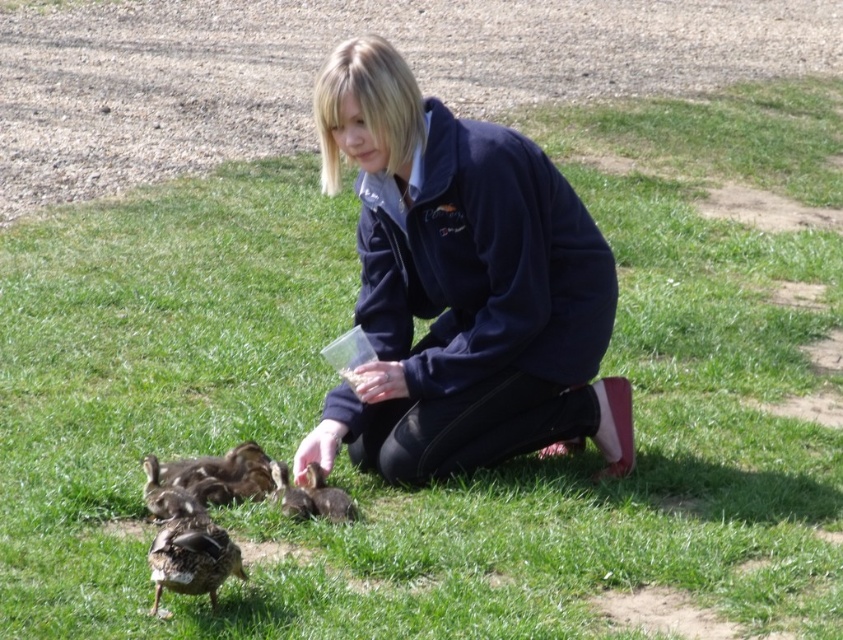
Is navy blue fleece at center thinner than brown fuzzy duckling at lower left?

No.

Does navy blue fleece at center have a greater height compared to brown fuzzy duckling at lower left?

Indeed, navy blue fleece at center has a greater height compared to brown fuzzy duckling at lower left.

Which is behind, point (435, 132) or point (164, 508)?

Point (435, 132)

At what (x,y) coordinates should I click in order to perform the action: click on navy blue fleece at center. Please return your answer as a coordinate pair (x, y). Looking at the image, I should click on (460, 288).

At what (x,y) coordinates should I click in order to perform the action: click on brown feathered duckling at lower left. Please return your answer as a coordinate pair (x, y). The height and width of the screenshot is (640, 843). Looking at the image, I should click on (191, 552).

Is point (170, 536) positioned before point (165, 518)?

Yes, point (170, 536) is in front of point (165, 518).

The height and width of the screenshot is (640, 843). In order to click on brown feathered duckling at lower left in this screenshot , I will do `click(191, 552)`.

Is brown feathered duckling at lower left to the right of brown fuzzy duckling at lower center from the viewer's perspective?

In fact, brown feathered duckling at lower left is to the left of brown fuzzy duckling at lower center.

The width and height of the screenshot is (843, 640). In order to click on brown feathered duckling at lower left in this screenshot , I will do `click(191, 552)`.